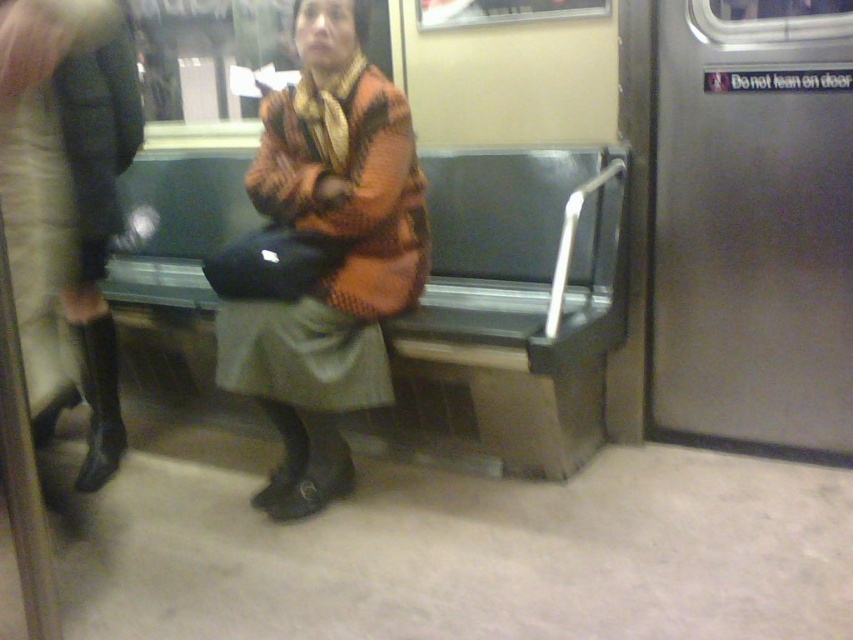
Can you confirm if green fabric bench at center is smaller than velvet black boots at left?

No.

Consider the image. Is green fabric bench at center taller than velvet black boots at left?

Incorrect, green fabric bench at center's height is not larger of velvet black boots at left's.

Which is behind, point (521, 284) or point (53, 138)?

The point (521, 284) is more distant.

I want to click on green fabric bench at center, so click(509, 314).

Looking at this image, between green fabric bench at center and orange knitted sweater at center, which one has more height?

orange knitted sweater at center

How much distance is there between green fabric bench at center and orange knitted sweater at center?

green fabric bench at center and orange knitted sweater at center are 14.89 inches apart from each other.

Is point (143, 284) more distant than point (355, 138)?

Yes, point (143, 284) is farther from viewer.

Find the location of `green fabric bench at center`. green fabric bench at center is located at coordinates (509, 314).

Who is more forward, (360, 168) or (20, 20)?

Point (20, 20)

Which is above, orange knitted sweater at center or velvet black boots at left?

velvet black boots at left is higher up.

You are a GUI agent. You are given a task and a screenshot of the screen. Output one action in this format:
    pyautogui.click(x=<x>, y=<y>)
    Task: Click on the orange knitted sweater at center
    The width and height of the screenshot is (853, 640).
    Given the screenshot: What is the action you would take?
    pyautogui.click(x=334, y=262)